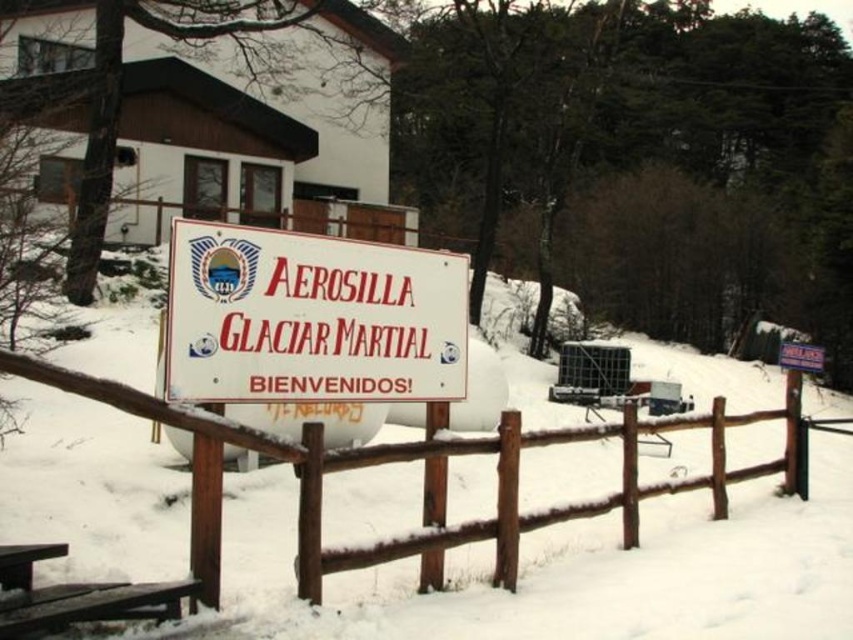
You are standing at point (318, 525) and want to walk to the signboard. The path is 14.95 feet long. If you walk at 3 feet per second, how many seconds will it take you to reach the signboard?

The distance between the point (318, 525) and the signboard is 14.95 feet. At a walking speed of 3 feet per second, it will take 14.95 divided by 3, which is approximately 4.98 seconds. So, it will take about 5 seconds to reach the signboard.

You are a visitor at the park and want to sit at the brown wooden picnic table at lower left. From your current position in front of the white matte sign at center, which direction should you move to reach the picnic table?

The brown wooden picnic table at lower left is behind the white matte sign at center, so you should move backward to reach it.